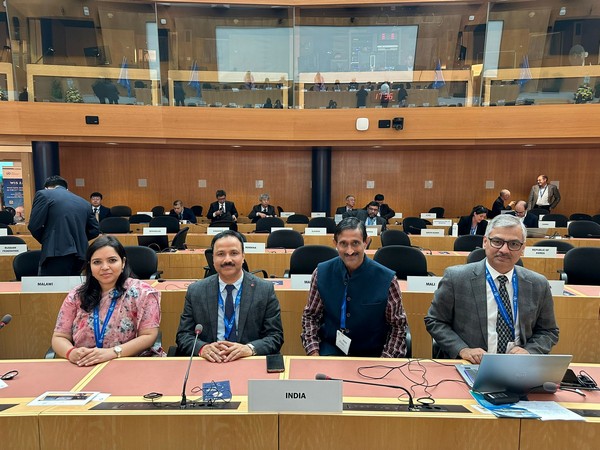
Find the location of a particular element. The height and width of the screenshot is (450, 600). screens is located at coordinates (394, 42), (246, 51).